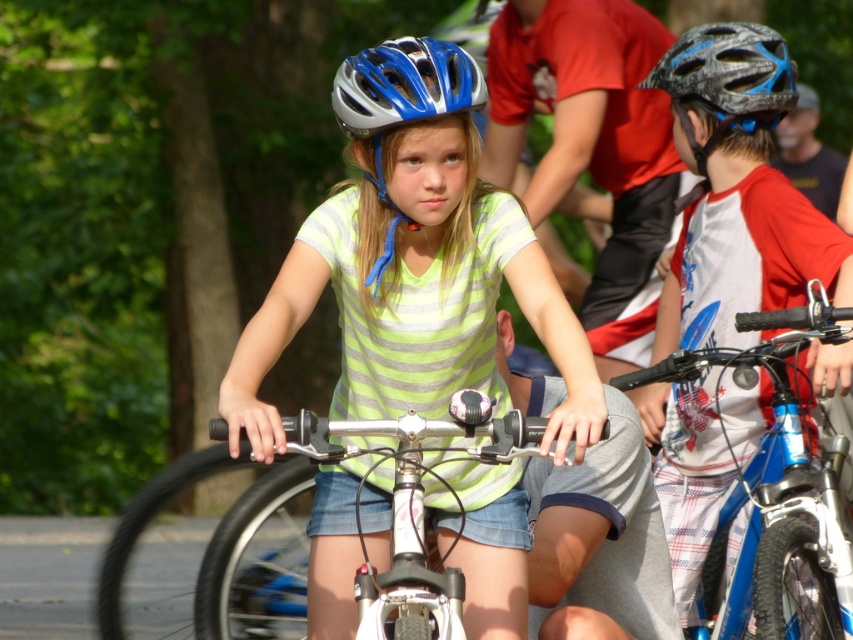
Where is `matte plastic helmet at center`? This screenshot has width=853, height=640. matte plastic helmet at center is located at coordinates (424, 276).

Is shiny blue helmet at right behind matte black helmet at upper right?

No.

The height and width of the screenshot is (640, 853). What are the coordinates of `shiny blue helmet at right` in the screenshot? It's located at (738, 193).

Can you confirm if shiny blue helmet at right is thinner than matte silver helmet at center?

No, shiny blue helmet at right is not thinner than matte silver helmet at center.

What are the coordinates of `shiny blue helmet at right` in the screenshot? It's located at (738, 193).